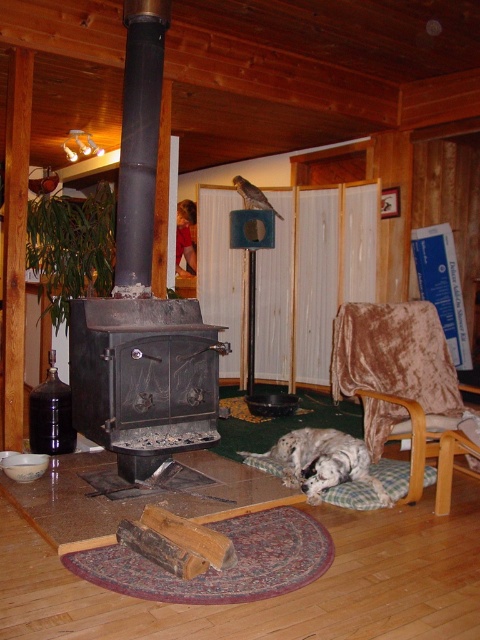
Question: Is black matte fireplace at left closer to camera compared to black cast iron fireplace at center?

Choices:
 (A) yes
 (B) no

Answer: (B)

Question: Which point is closer to the camera?

Choices:
 (A) (203, 388)
 (B) (192, 396)
 (C) (425, 420)
 (D) (348, 464)

Answer: (D)

Question: Which object appears farthest from the camera in this image?

Choices:
 (A) black cast iron fireplace at center
 (B) velvet brown rocking chair at lower right
 (C) black matte fireplace at left
 (D) white fluffy dog at lower center

Answer: (B)

Question: Does black matte fireplace at left have a greater width compared to white fluffy dog at lower center?

Choices:
 (A) yes
 (B) no

Answer: (A)

Question: Which point is farther to the camera?

Choices:
 (A) (441, 324)
 (B) (128, 474)
 (C) (320, 461)
 (D) (147, 417)

Answer: (A)

Question: Does black matte fireplace at left have a larger size compared to velvet brown rocking chair at lower right?

Choices:
 (A) no
 (B) yes

Answer: (B)